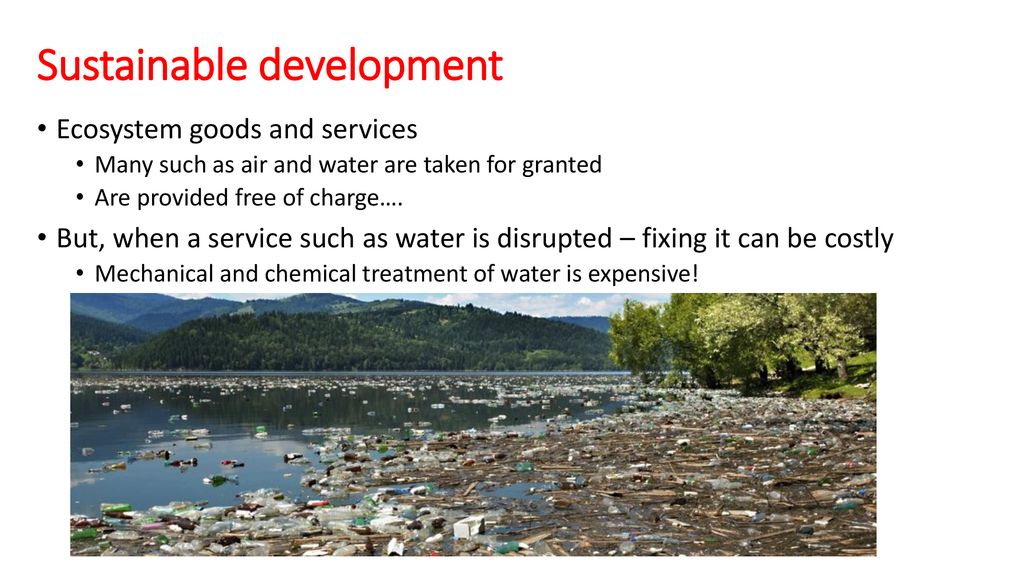
The image size is (1024, 576). I want to click on trash, so [x=725, y=490], [x=289, y=382].